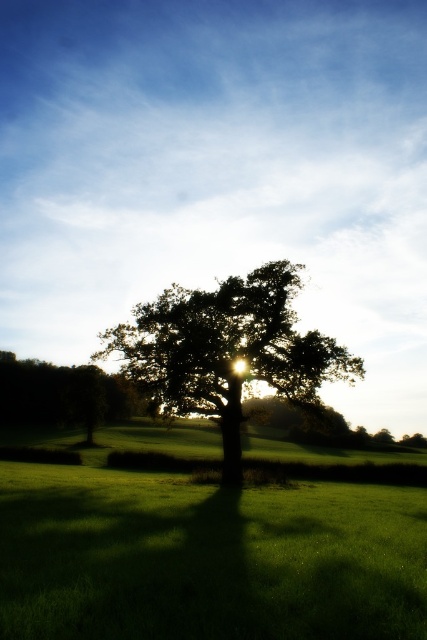
Is point (172, 401) farther from viewer compared to point (38, 413)?

No, (172, 401) is in front of (38, 413).

Locate an element on the screen. The width and height of the screenshot is (427, 640). dark green leafy oak tree at center is located at coordinates (228, 349).

In the scene shown: Does green grass at center come behind dark green leafy oak tree at center?

No.

Who is more distant from viewer, (61,612) or (172,326)?

The point (172,326) is more distant.

Identify the location of green grass at center. (204, 552).

Who is more distant from viewer, (330, 561) or (46, 378)?

The point (46, 378) is more distant.

Is point (183, 545) positioned after point (108, 392)?

No, it is in front of (108, 392).

Which is in front, point (245, 632) or point (5, 364)?

Point (245, 632)

Where is `green grass at center`? This screenshot has height=640, width=427. green grass at center is located at coordinates (204, 552).